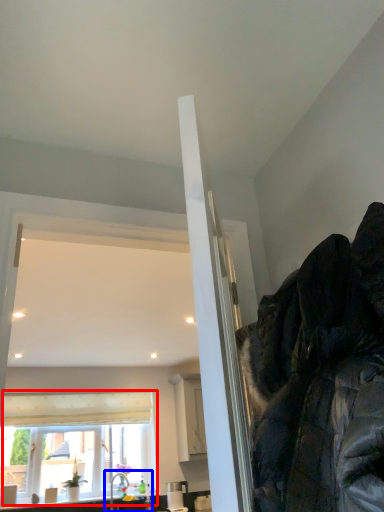
Question: Among these objects, which one is nearest to the camera, window (highlighted by a red box) or sink (highlighted by a blue box)?

Choices:
 (A) window
 (B) sink

Answer: (B)